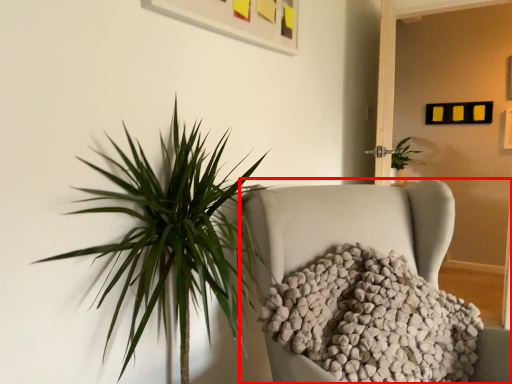
Question: From the image, what is the correct spatial relationship of furniture (annotated by the red box) in relation to houseplant?

Choices:
 (A) right
 (B) left

Answer: (B)